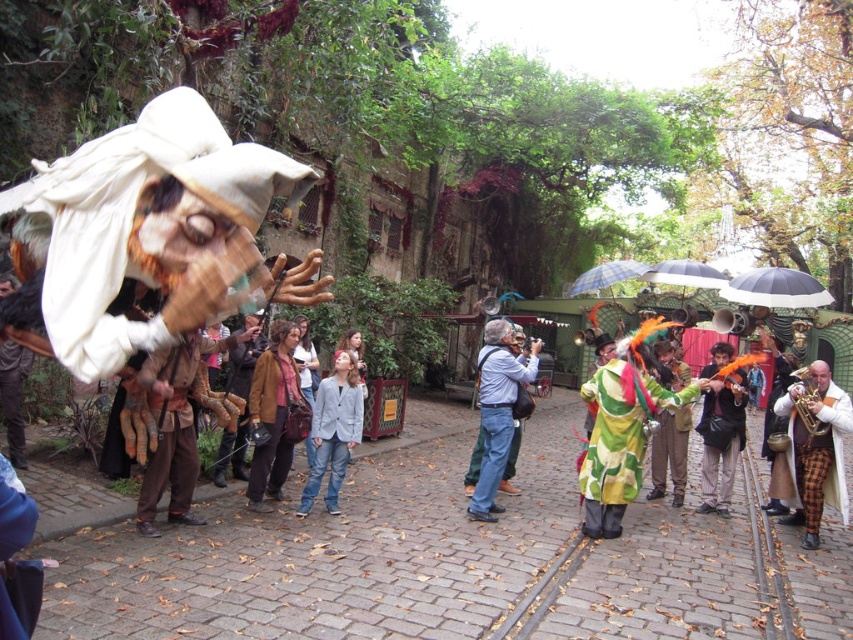
You are a photographer trying to capture both the green fabric costume at center and the brown leather jacket at center in a single frame. Given their sizes, which object should you focus on to ensure both are visible without zooming in or out?

The green fabric costume at center is larger than the brown leather jacket at center. To capture both in a single frame without zooming, focus on the green fabric costume at center since it occupies more space, allowing the smaller brown leather jacket at center to fit within the same frame.

You are a street performer standing in the middle of the cobblestone street. You need to place a new prop that is 18 inches wide between the light gray cotton jacket at center and the brown leather jacket at center. Will there be enough space?

The distance between the light gray cotton jacket at center and the brown leather jacket at center is 19.21 inches. Since the prop is 18 inches wide, there is enough space to place it between them.

Based on the photo, you are a street performer standing in the middle of the cobblestone street. You have a light gray cotton jacket at center and a checkered fabric umbrella at center. If you want to pick up both items without moving your feet, can you reach them both at the same time?

The light gray cotton jacket at center and checkered fabric umbrella at center are 9.79 meters apart from each other. Since the average human arm span is about 1.5 to 2 meters, you cannot reach both items simultaneously without moving your feet.